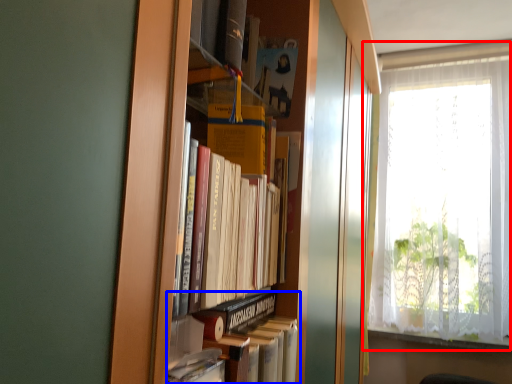
Question: Among these objects, which one is nearest to the camera, window (highlighted by a red box) or book (highlighted by a blue box)?

Choices:
 (A) window
 (B) book

Answer: (B)